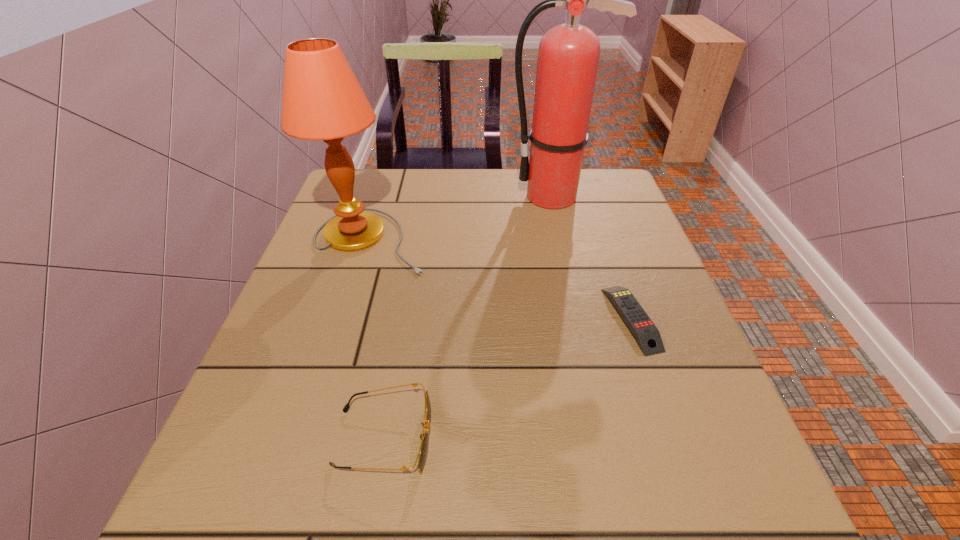
Locate an element on the screen. Image resolution: width=960 pixels, height=540 pixels. blank area in the image that satisfies the following two spatial constraints: 1. on the hose direction of the second nearest object; 2. on the left side of the fire extinguisher is located at coordinates (582, 319).